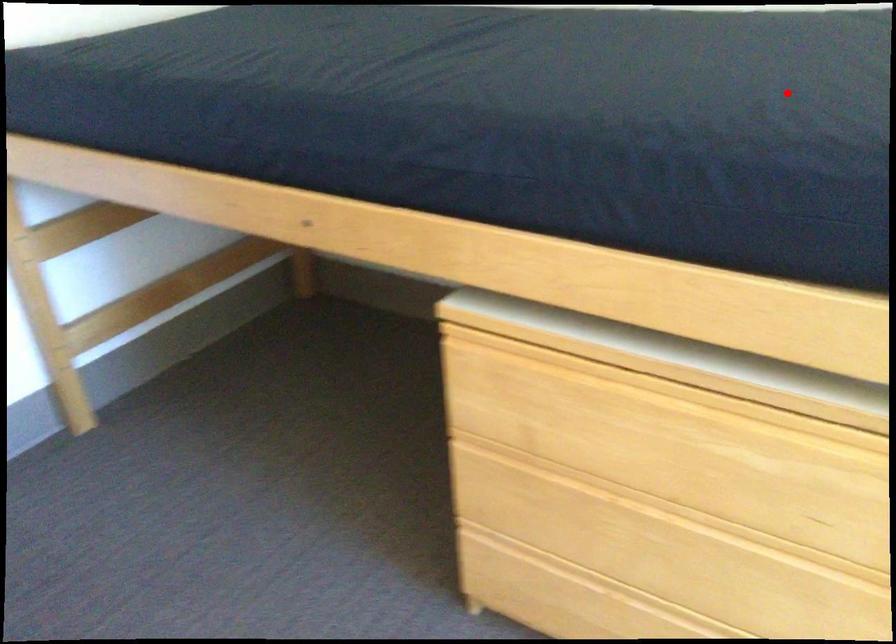
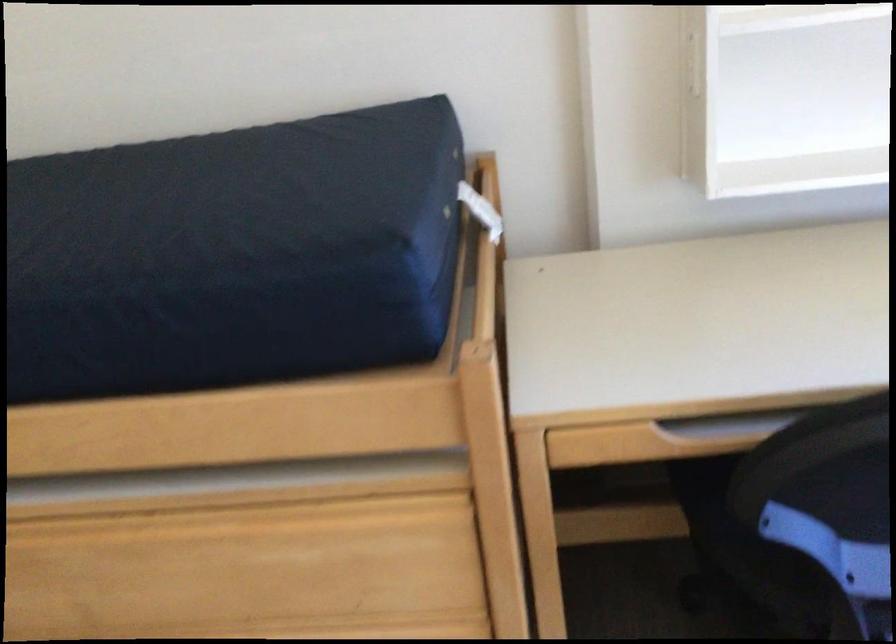
In the second image, find the point that corresponds to the highlighted location in the first image.

(243, 221)